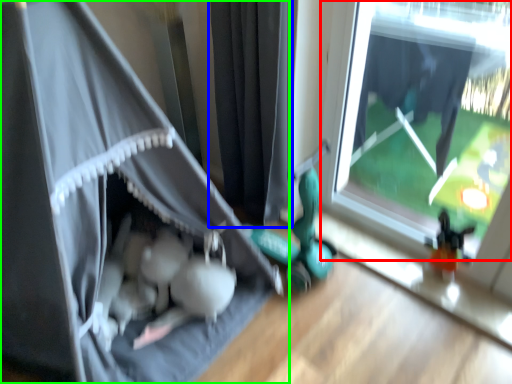
Question: Considering the real-world distances, which object is farthest from window (highlighted by a red box)? curtain (highlighted by a blue box) or curtain (highlighted by a green box)?

Choices:
 (A) curtain
 (B) curtain

Answer: (B)